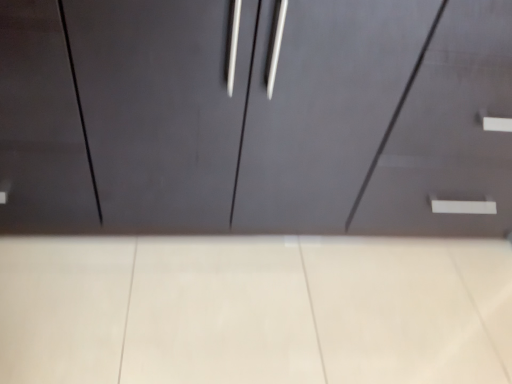
Measure the distance between point (286, 147) and camera.

The distance of point (286, 147) from camera is 1.03 meters.

Image resolution: width=512 pixels, height=384 pixels. Describe the element at coordinates (256, 116) in the screenshot. I see `matte dark gray cupboard at center` at that location.

Find the location of a particular element. The width and height of the screenshot is (512, 384). matte dark gray cupboard at center is located at coordinates (256, 116).

Locate an element on the screen. matte dark gray cupboard at center is located at coordinates (256, 116).